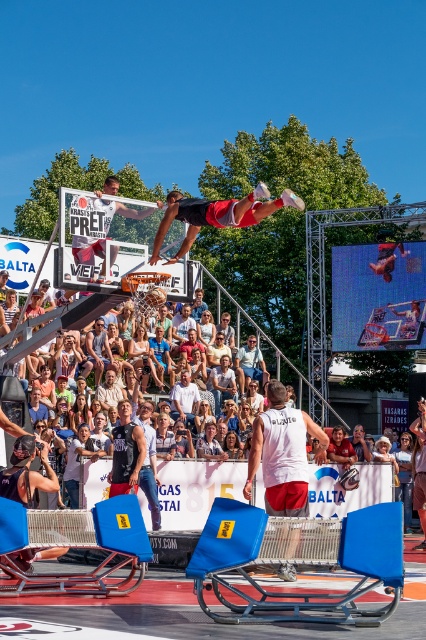
Question: Which is farther from the matte black basketball hoop at center?

Choices:
 (A) white matte tank top at center
 (B) light brown leather jacket at center
 (C) light brown wooden chair at lower right
 (D) black leather jacket at center

Answer: (C)

Question: Which is nearer to the black leather jacket at center?

Choices:
 (A) light brown leather jacket at center
 (B) matte black basketball hoop at center

Answer: (B)

Question: Can you confirm if white matte tank top at center is positioned to the left of matte black basketball hoop at center?

Choices:
 (A) no
 (B) yes

Answer: (A)

Question: Can you confirm if light brown wooden chair at lower right is bigger than white cotton shirt at center?

Choices:
 (A) yes
 (B) no

Answer: (A)

Question: Which is farther from the white matte tank top at center?

Choices:
 (A) black leather jacket at center
 (B) light brown leather jacket at center
 (C) white cotton shirt at center

Answer: (C)

Question: Is white matte tank top at center closer to camera compared to light brown wooden chair at lower right?

Choices:
 (A) yes
 (B) no

Answer: (A)